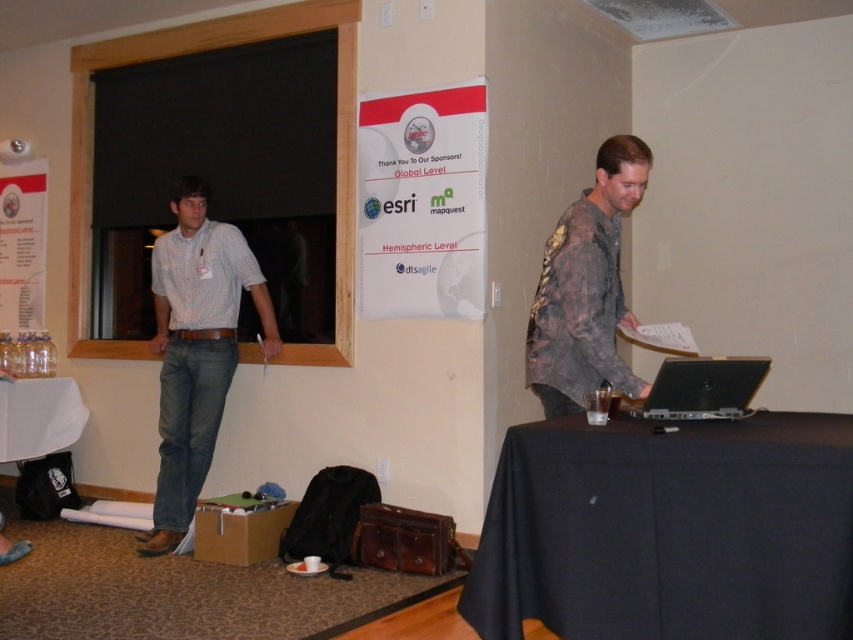
Question: Is checkered shirt at left smaller than wooden frame window at left?

Choices:
 (A) yes
 (B) no

Answer: (A)

Question: Does wooden frame window at left appear on the left side of camouflage fabric shirt at right?

Choices:
 (A) yes
 (B) no

Answer: (A)

Question: Can you confirm if black fabric table at lower right is positioned below wooden frame window at left?

Choices:
 (A) no
 (B) yes

Answer: (B)

Question: Among these objects, which one is nearest to the camera?

Choices:
 (A) black fabric table at lower right
 (B) wooden frame window at left
 (C) checkered shirt at left

Answer: (A)

Question: Which point appears farthest from the camera in this image?

Choices:
 (A) (676, 406)
 (B) (624, 516)
 (C) (71, 193)
 (D) (602, 195)

Answer: (C)

Question: Which object is positioned farthest from the silver metallic laptop at center?

Choices:
 (A) black fabric table at lower right
 (B) checkered shirt at left
 (C) wooden frame window at left
 (D) camouflage fabric shirt at right

Answer: (C)